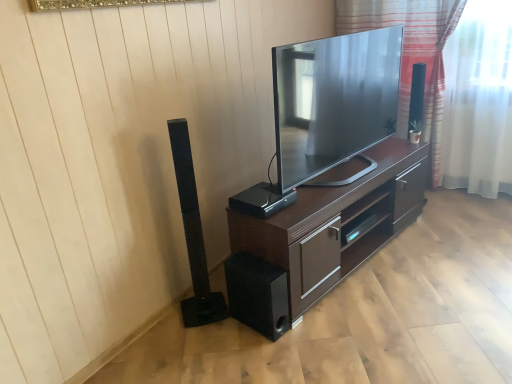
The height and width of the screenshot is (384, 512). Identify the location of free point above black matte speaker at lower center, the 2th speaker positioned from the right (from a real-world perspective). (256, 266).